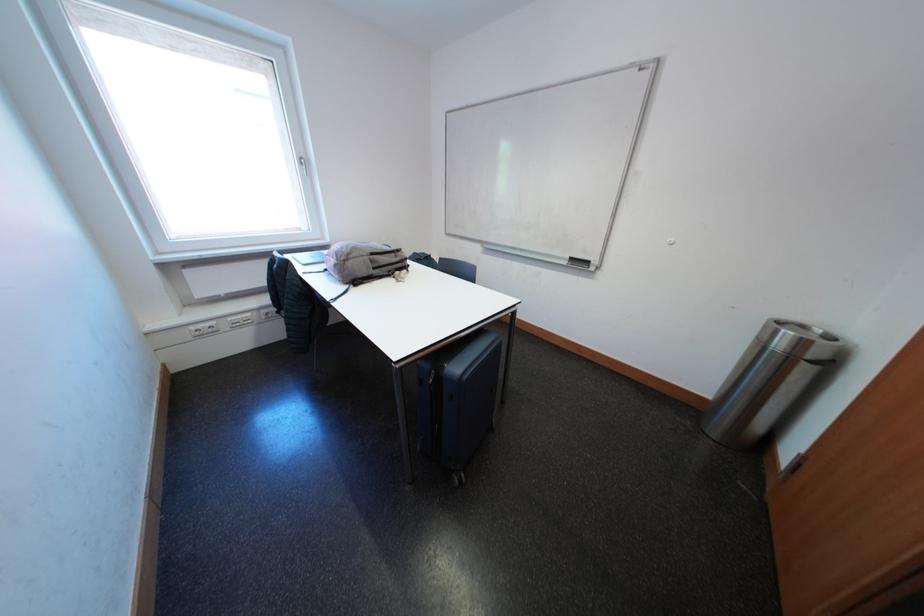
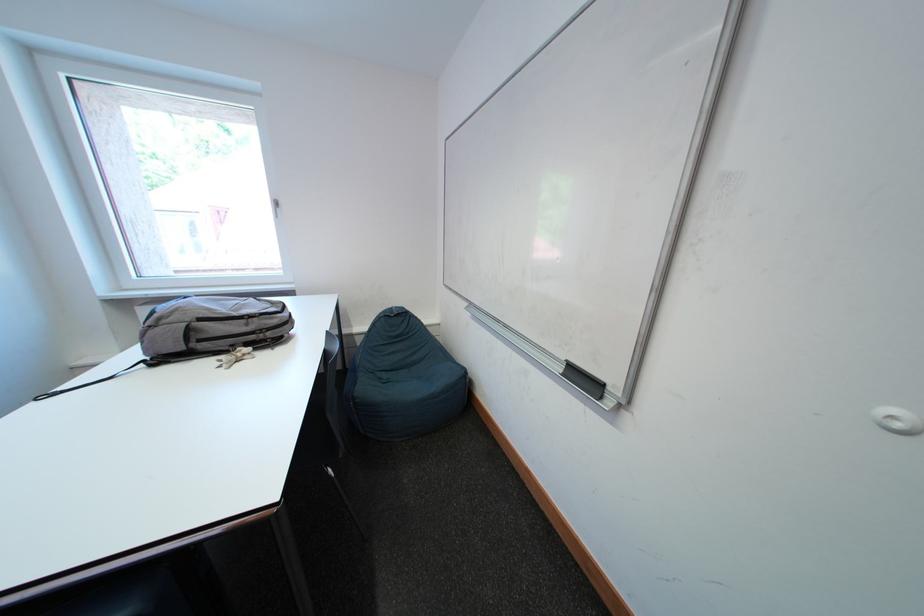
The point at (x=398, y=275) is marked in the first image. Where is the corresponding point in the second image?

(241, 349)